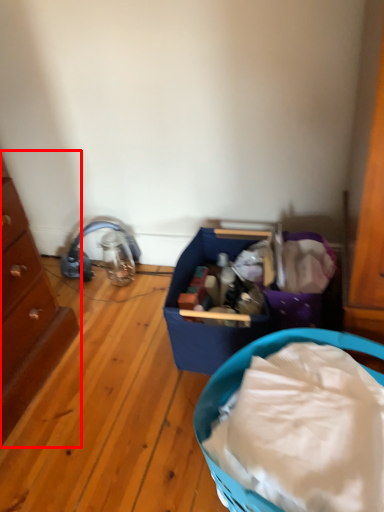
Question: From the image's perspective, considering the relative positions of chest of drawers (annotated by the red box) and basket container in the image provided, where is chest of drawers (annotated by the red box) located with respect to the staircase?

Choices:
 (A) below
 (B) above

Answer: (B)